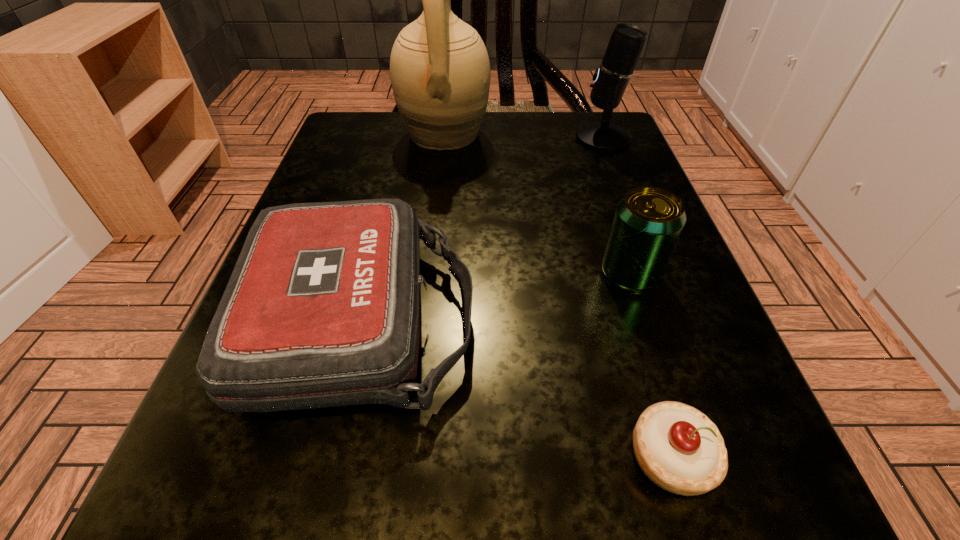
Identify the location of vacant area that lies between the fourth shortest object and the first-aid kit. The width and height of the screenshot is (960, 540). (481, 228).

What are the coordinates of `vacant space that is in between the second shortest object and the third shortest object` in the screenshot? It's located at (495, 296).

The width and height of the screenshot is (960, 540). Identify the location of unoccupied position between the fourth shortest object and the first-aid kit. (481, 228).

Identify the location of vacant point located between the first-aid kit and the beer can. (495, 296).

Where is `free space between the tallest object and the pastry`? The height and width of the screenshot is (540, 960). free space between the tallest object and the pastry is located at coordinates (558, 296).

You are a GUI agent. You are given a task and a screenshot of the screen. Output one action in this format:
    pyautogui.click(x=<x>, y=<y>)
    Task: Click on the free point between the tallest object and the beer can
    The image size is (960, 540).
    Given the screenshot: What is the action you would take?
    [538, 205]

At what (x,y) coordinates should I click in order to perform the action: click on object that stands as the closest to the beer can. Please return your answer as a coordinate pair (x, y). The height and width of the screenshot is (540, 960). Looking at the image, I should click on (679, 448).

This screenshot has width=960, height=540. I want to click on object that is the third closest to the tallest object, so click(x=648, y=221).

The height and width of the screenshot is (540, 960). Find the location of `vacant area that satisfies the following two spatial constraints: 1. on the back side of the pastry; 2. on the right side of the third shortest object`. vacant area that satisfies the following two spatial constraints: 1. on the back side of the pastry; 2. on the right side of the third shortest object is located at coordinates (616, 274).

Where is `vacant space that satisfies the following two spatial constraints: 1. on the back side of the second tallest object; 2. on the left side of the third shortest object`? This screenshot has height=540, width=960. vacant space that satisfies the following two spatial constraints: 1. on the back side of the second tallest object; 2. on the left side of the third shortest object is located at coordinates (586, 138).